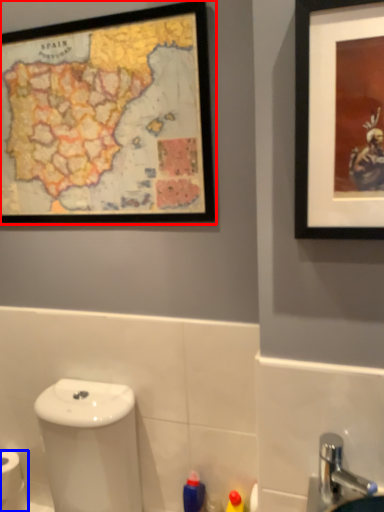
Question: Which point is closer to the camera, picture frame (highlighted by a red box) or toilet paper (highlighted by a blue box)?

Choices:
 (A) picture frame
 (B) toilet paper

Answer: (A)